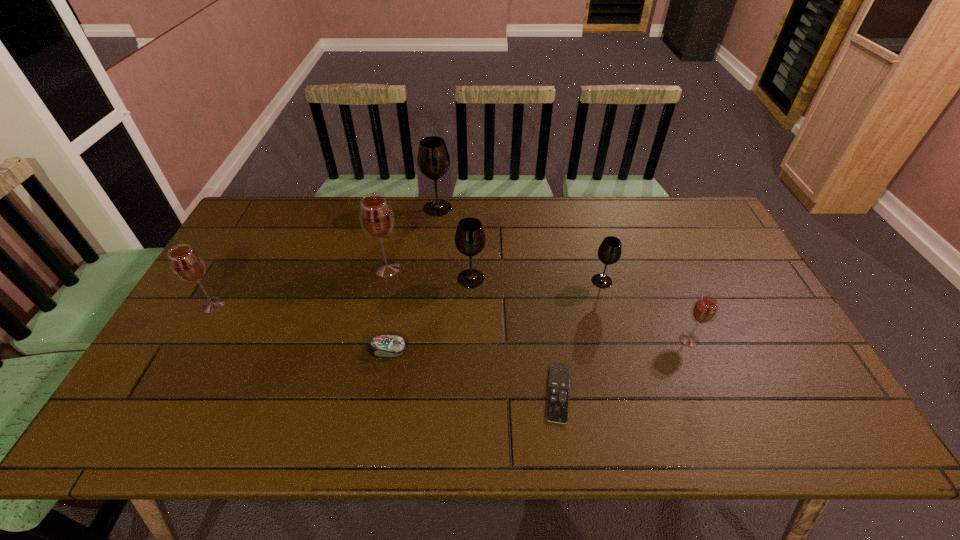
This screenshot has width=960, height=540. I want to click on free space at the near left corner of the desktop, so click(x=169, y=437).

You are a GUI agent. You are given a task and a screenshot of the screen. Output one action in this format:
    pyautogui.click(x=<x>, y=<y>)
    Task: Click on the free location at the far right corner
    
    Given the screenshot: What is the action you would take?
    pyautogui.click(x=673, y=206)

This screenshot has width=960, height=540. I want to click on free space at the near right corner, so click(794, 438).

The image size is (960, 540). Find the location of `empty space between the fourth object from right to left and the fifth wineglass from right to left`. empty space between the fourth object from right to left and the fifth wineglass from right to left is located at coordinates (429, 273).

This screenshot has width=960, height=540. In order to click on unoccupied position between the third wineglass from left to right and the smallest gray wineglass in this screenshot , I will do `click(519, 245)`.

This screenshot has height=540, width=960. Find the location of `free spot between the seventh tallest object and the seventh object from left to right`. free spot between the seventh tallest object and the seventh object from left to right is located at coordinates tap(494, 315).

What are the coordinates of `free space between the rightmost object and the rightmost gray wineglass` in the screenshot? It's located at (645, 310).

The image size is (960, 540). In order to click on free space between the second shortest object and the nearest wineglass in this screenshot , I will do `click(539, 344)`.

I want to click on vacant area that lies between the second red wineglass from left to right and the farthest object, so click(x=412, y=238).

Locate an element on the screen. The image size is (960, 540). free space between the smallest red wineglass and the second gray wineglass from right to left is located at coordinates (580, 309).